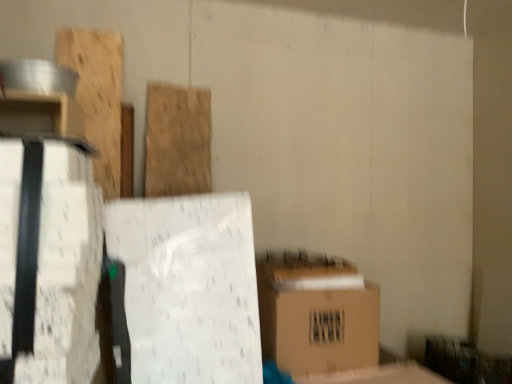
Question: Which direction should I rotate to face natural wood plank at center, marked as the second wood in a left-to-right arrangement, — up or down?

Choices:
 (A) up
 (B) down

Answer: (A)

Question: Can you confirm if wooden plank at upper left, the first wood from the left, is smaller than natural wood plank at center, marked as the second wood in a left-to-right arrangement?

Choices:
 (A) no
 (B) yes

Answer: (A)

Question: Is wooden plank at upper left, the first wood from the left, looking in the opposite direction of natural wood plank at center, marked as the second wood in a left-to-right arrangement?

Choices:
 (A) no
 (B) yes

Answer: (A)

Question: Can you confirm if wooden plank at upper left, the first wood from the left, is bigger than natural wood plank at center, marked as the second wood in a left-to-right arrangement?

Choices:
 (A) no
 (B) yes

Answer: (B)

Question: Is wooden plank at upper left, marked as the second wood in a right-to-left arrangement, positioned far away from natural wood plank at center, marked as the second wood in a left-to-right arrangement?

Choices:
 (A) yes
 (B) no

Answer: (B)

Question: From a real-world perspective, does wooden plank at upper left, marked as the second wood in a right-to-left arrangement, sit lower than natural wood plank at center, the 1th wood viewed from the right?

Choices:
 (A) no
 (B) yes

Answer: (A)

Question: Is wooden plank at upper left, marked as the second wood in a right-to-left arrangement, oriented towards natural wood plank at center, the 1th wood viewed from the right?

Choices:
 (A) no
 (B) yes

Answer: (A)

Question: Considering the relative sizes of white matte cardboard box at left and wooden plank at upper left, the first wood from the left, in the image provided, is white matte cardboard box at left wider than wooden plank at upper left, the first wood from the left,?

Choices:
 (A) yes
 (B) no

Answer: (A)

Question: Is white matte cardboard box at left to the right of wooden plank at upper left, marked as the second wood in a right-to-left arrangement, from the viewer's perspective?

Choices:
 (A) yes
 (B) no

Answer: (A)

Question: Are white matte cardboard box at left and wooden plank at upper left, the first wood from the left, making contact?

Choices:
 (A) no
 (B) yes

Answer: (A)

Question: Is white matte cardboard box at left facing towards wooden plank at upper left, the first wood from the left?

Choices:
 (A) yes
 (B) no

Answer: (B)

Question: Can you confirm if white matte cardboard box at left is taller than wooden plank at upper left, marked as the second wood in a right-to-left arrangement?

Choices:
 (A) yes
 (B) no

Answer: (A)

Question: From a real-world perspective, is white matte cardboard box at left physically above wooden plank at upper left, the first wood from the left?

Choices:
 (A) yes
 (B) no

Answer: (B)

Question: From a real-world perspective, does brown cardboard box at lower right stand above white matte cardboard box at left?

Choices:
 (A) no
 (B) yes

Answer: (A)